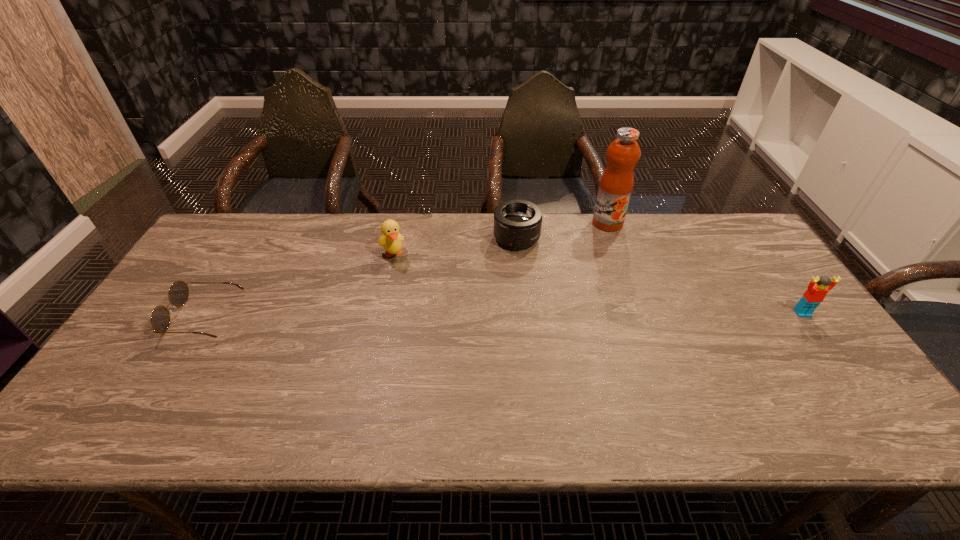
Identify the location of fruit juice that is positioned at the far edge. (616, 184).

Identify the location of object that is at the left edge. Image resolution: width=960 pixels, height=540 pixels. (178, 294).

The width and height of the screenshot is (960, 540). I want to click on object that is at the right edge, so click(818, 287).

Locate an element on the screen. The image size is (960, 540). free space at the far edge of the desktop is located at coordinates (271, 235).

At what (x,y) coordinates should I click in order to perform the action: click on vacant space at the near edge of the desktop. Please return your answer as a coordinate pair (x, y). This screenshot has height=540, width=960. Looking at the image, I should click on (402, 370).

Locate an element on the screen. Image resolution: width=960 pixels, height=540 pixels. vacant space at the right edge is located at coordinates (769, 304).

Locate an element on the screen. vacant space at the far left corner of the desktop is located at coordinates (223, 234).

Locate an element on the screen. vacant region at the far right corner of the desktop is located at coordinates (739, 233).

This screenshot has height=540, width=960. Find the location of `free region at the near right corner of the desktop`. free region at the near right corner of the desktop is located at coordinates (845, 383).

Locate an element on the screen. The height and width of the screenshot is (540, 960). vacant region between the fourth tallest object and the rightmost object is located at coordinates (660, 275).